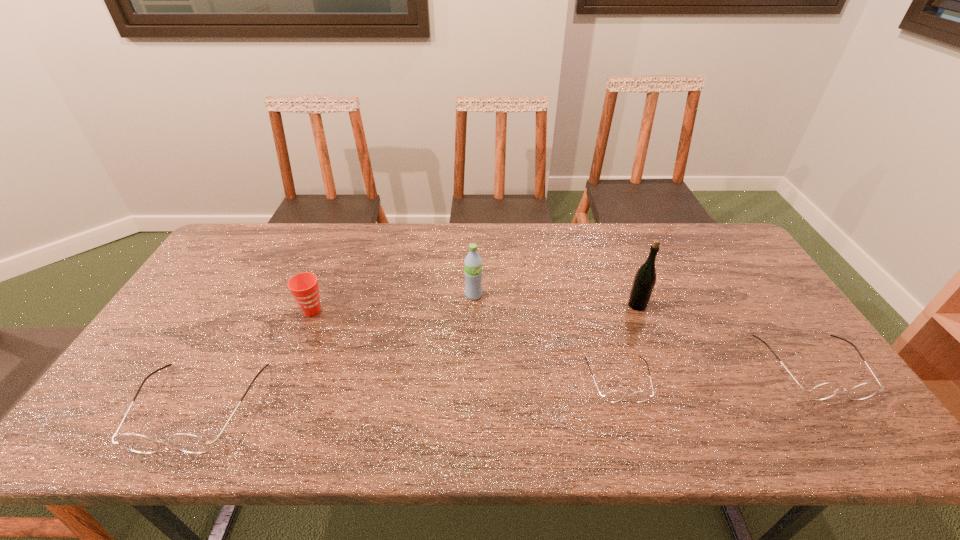
The image size is (960, 540). I want to click on vacant area that lies between the leftmost spectacles and the water bottle, so click(x=336, y=351).

This screenshot has height=540, width=960. Identify the location of free space that is in between the second shortest object and the water bottle. (643, 331).

Image resolution: width=960 pixels, height=540 pixels. Identify the location of free space between the third object from left to right and the second object from left to right. (393, 303).

Locate an element on the screen. The height and width of the screenshot is (540, 960). free space between the fifth tallest object and the beer bottle is located at coordinates (725, 336).

Identify the location of object that ranks as the fourth closest to the second spectacles from right to left. (304, 286).

Select which object appears as the second closest to the leftmost object. Please provide its 2D coordinates. Your answer should be formatted as a tuple, i.e. [(x, y)], where the tuple contains the x and y coordinates of a point satisfying the conditions above.

[(473, 262)]

Locate an element on the screen. the closest spectacles to the second spectacles from left to right is located at coordinates (823, 391).

Point out which spectacles is positioned as the second nearest to the water bottle. Please provide its 2D coordinates. Your answer should be formatted as a tuple, i.e. [(x, y)], where the tuple contains the x and y coordinates of a point satisfying the conditions above.

[(189, 443)]

Where is `free space that satisfies the following two spatial constraints: 1. on the back side of the fourth object from right to left; 2. on the right side of the cup`? The height and width of the screenshot is (540, 960). free space that satisfies the following two spatial constraints: 1. on the back side of the fourth object from right to left; 2. on the right side of the cup is located at coordinates (319, 295).